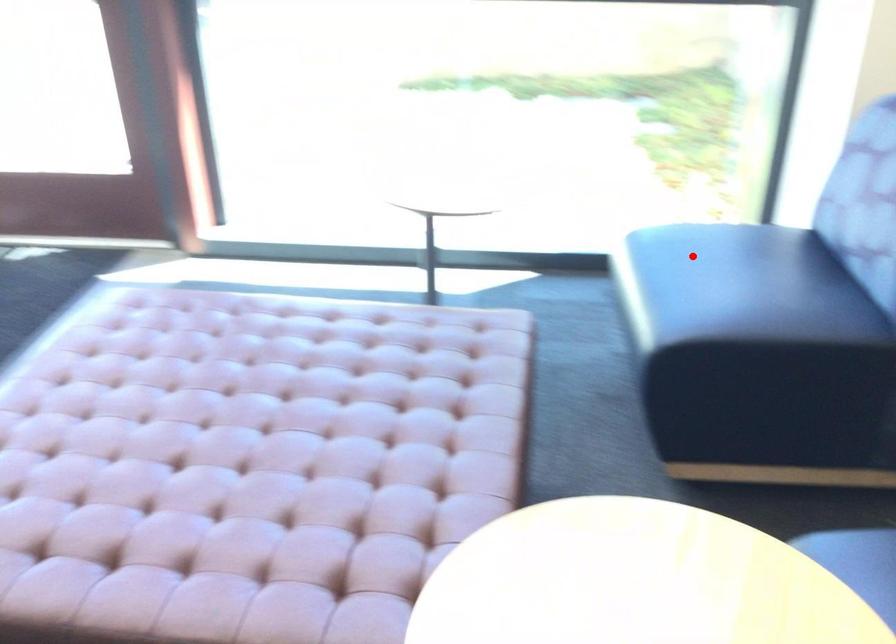
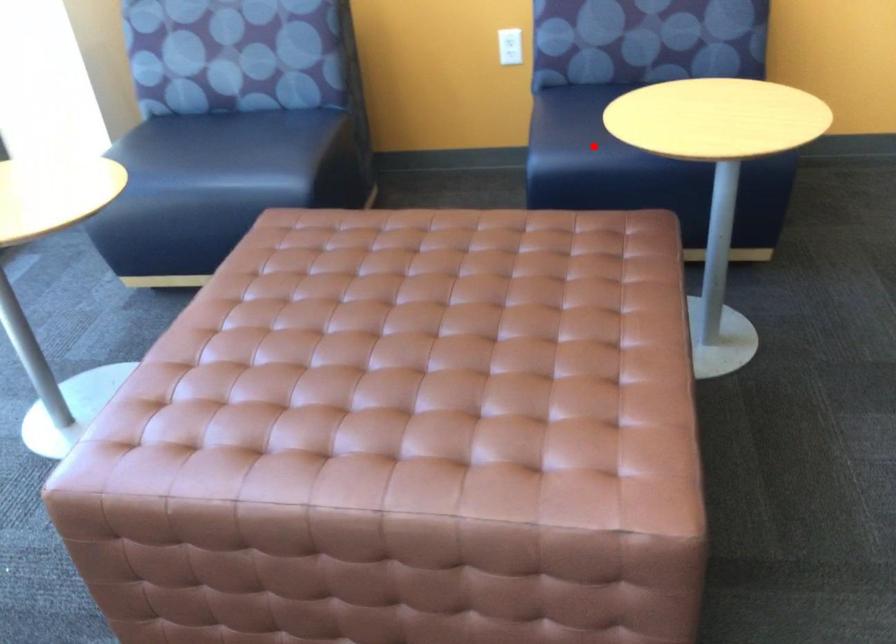
I am providing you with two images of the same scene from different viewpoints. A red point is marked on the first image and another point is marked on the second image. Does the point marked in image1 correspond to the same location as the one in image2?

No